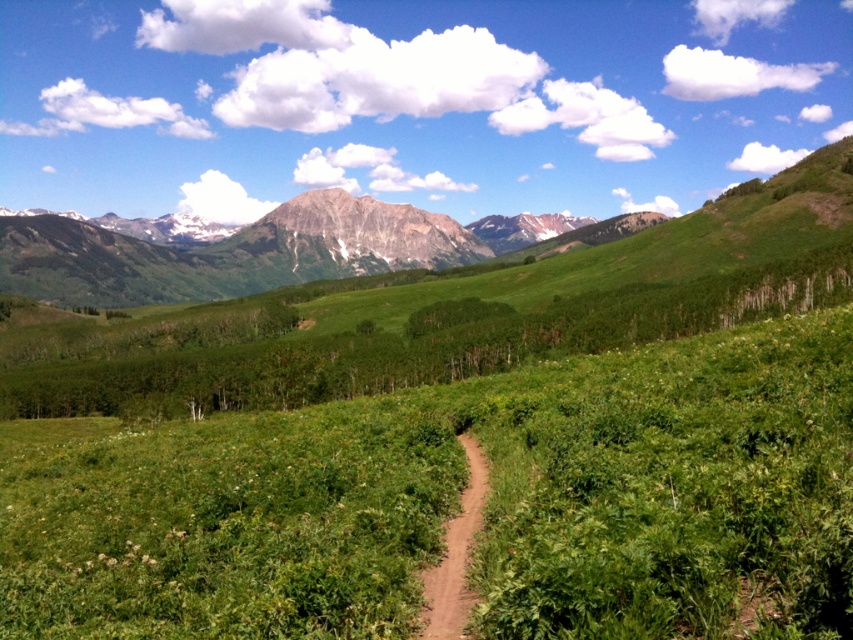
In the scene shown: Between green leafy grass at center and rustic granite mountain at center, which one has more height?

With more height is rustic granite mountain at center.

Image resolution: width=853 pixels, height=640 pixels. I want to click on green leafy grass at center, so click(457, 504).

Image resolution: width=853 pixels, height=640 pixels. Describe the element at coordinates (457, 504) in the screenshot. I see `green leafy grass at center` at that location.

Where is `green leafy grass at center`? This screenshot has height=640, width=853. green leafy grass at center is located at coordinates (457, 504).

Is green leafy grass at center to the left of brown dirt path at center from the viewer's perspective?

Correct, you'll find green leafy grass at center to the left of brown dirt path at center.

Does green leafy grass at center come behind brown dirt path at center?

No, it is in front of brown dirt path at center.

Is point (834, 317) less distant than point (457, 573)?

No, it is behind (457, 573).

Locate an element on the screen. The height and width of the screenshot is (640, 853). green leafy grass at center is located at coordinates (457, 504).

Does point (274, 209) lie in front of point (485, 472)?

No, (274, 209) is behind (485, 472).

Is rustic granite mountain at center to the right of brown dirt path at center from the viewer's perspective?

No, rustic granite mountain at center is not to the right of brown dirt path at center.

At what (x,y) coordinates should I click in order to perform the action: click on rustic granite mountain at center. Please return your answer as a coordinate pair (x, y). This screenshot has width=853, height=640. Looking at the image, I should click on point(341,241).